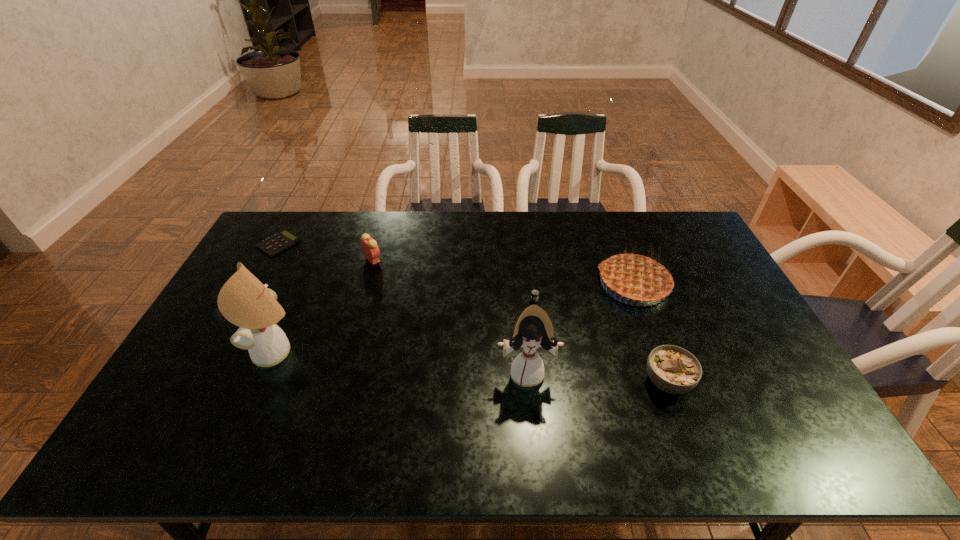
The width and height of the screenshot is (960, 540). In order to click on the tallest object in this screenshot , I will do `click(244, 301)`.

At what (x,y) coordinates should I click in order to perform the action: click on the left doll. Please return your answer as a coordinate pair (x, y). The width and height of the screenshot is (960, 540). Looking at the image, I should click on (244, 301).

At what (x,y) coordinates should I click in order to perform the action: click on the shorter doll. Please return your answer as a coordinate pair (x, y). The image size is (960, 540). Looking at the image, I should click on (534, 329).

Locate an element on the screen. The height and width of the screenshot is (540, 960). the second tallest object is located at coordinates (534, 329).

Locate an element on the screen. This screenshot has width=960, height=540. calculator is located at coordinates (276, 243).

Image resolution: width=960 pixels, height=540 pixels. Identify the location of the shortest object. (276, 243).

What are the coordinates of `alarm clock` in the screenshot? It's located at tap(370, 248).

Identify the location of the fourth tallest object. The image size is (960, 540). (370, 248).

Find the location of a particular element. The image size is (960, 540). the second shortest object is located at coordinates (535, 293).

Locate an element on the screen. The height and width of the screenshot is (540, 960). pie is located at coordinates (637, 277).